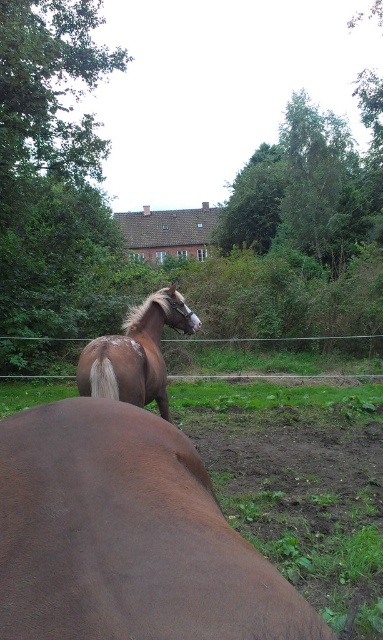
You are standing in a rural pasture and see the brown matte horse at center and the brown glossy horse at center. Which horse is closer to you?

The brown matte horse at center is closer to you because it is positioned in front of the brown glossy horse at center.

You are a farmer checking the pasture. You notice the brown matte horse at center and the green wire fence at center. Which object is narrower in width?

The brown matte horse at center is thinner than the green wire fence at center, so the brown matte horse at center is narrower in width.

You are standing in the pasture and want to throw a carrot to the horse that is closer to you. Which point should you aim for, point (57, 528) or point (148, 376)?

You should aim for point (57, 528) because it is closer to the camera than point (148, 376).